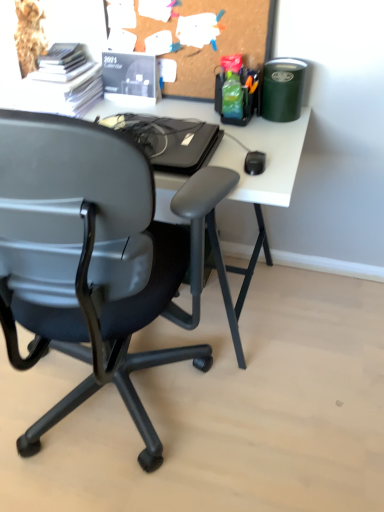
The height and width of the screenshot is (512, 384). I want to click on free spot to the left of translucent plastic organizer at upper right, the 3th stationery from the left, so point(190,110).